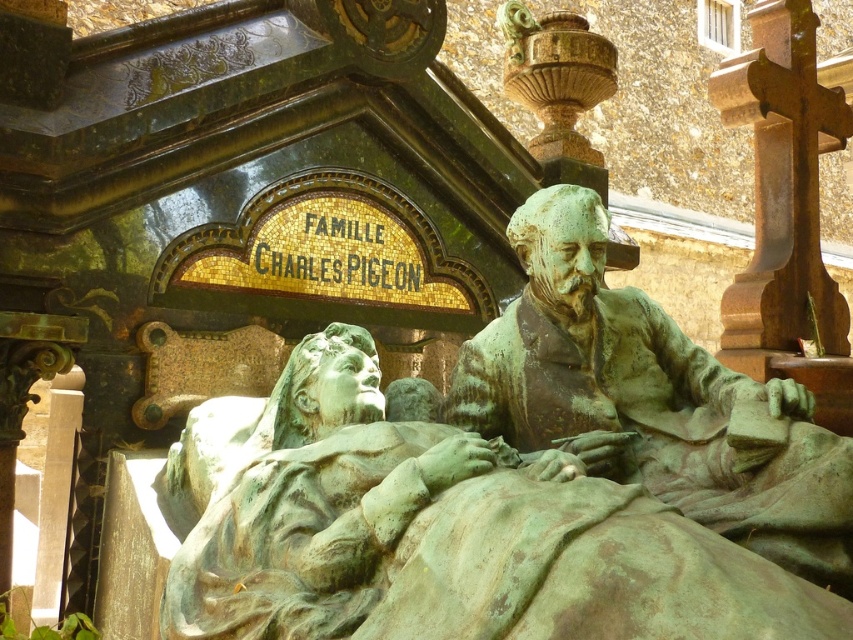
What is the relationship between the green patina statue at center and the green patinated bronze statue at center?

The green patina statue at center and the green patinated bronze statue at center are the same object. The term patina refers to the natural oxidation layer that forms on bronze over time, giving it a greenish hue. Thus, both labels describe the same statue, with the second label specifying the material and its aged appearance.

You are an archaeologist examining the sculpture and need to determine the spatial relationship between two specific points on it. Which of the two points, point 1 at coordinates (372, 595) or point 2 at coordinates (699, 408), is closer to you?

Point 1 at coordinates (372, 595) is closer to the viewer than point 2 at coordinates (699, 408).

You are an art conservator tasked with measuring the distance between the two statues in the cemetery scene. You have a measuring tape that can extend up to 5 meters. Can you measure the distance between the green patina statue at center and the green patinated bronze statue at center without needing a longer tape?

The distance between the green patina statue at center and the green patinated bronze statue at center is 4.48 meters, which is within the 5 meter capacity of your measuring tape. Therefore, you can measure the distance without needing a longer tape.